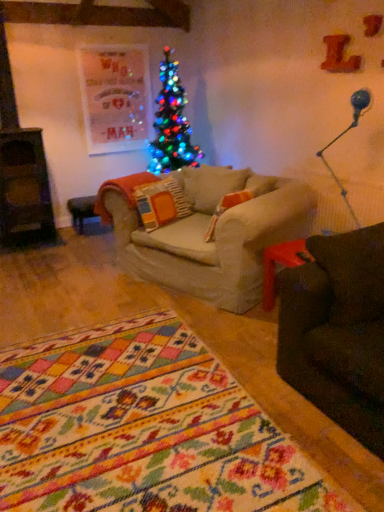
Question: Is blue glass lamp at upper right wider or thinner than knitted woolen pillow at center?

Choices:
 (A) wide
 (B) thin

Answer: (B)

Question: Relative to knitted woolen pillow at center, is blue glass lamp at upper right in front or behind?

Choices:
 (A) front
 (B) behind

Answer: (A)

Question: From a real-world perspective, is blue glass lamp at upper right positioned above or below knitted woolen pillow at center?

Choices:
 (A) below
 (B) above

Answer: (B)

Question: In the image, is knitted woolen pillow at center on the left side or the right side of blue glass lamp at upper right?

Choices:
 (A) left
 (B) right

Answer: (A)

Question: From their relative heights in the image, would you say knitted woolen pillow at center is taller or shorter than blue glass lamp at upper right?

Choices:
 (A) tall
 (B) short

Answer: (B)

Question: Is point (150, 195) closer or farther from the camera than point (362, 96)?

Choices:
 (A) farther
 (B) closer

Answer: (A)

Question: From the image's perspective, is knitted woolen pillow at center located above or below blue glass lamp at upper right?

Choices:
 (A) above
 (B) below

Answer: (B)